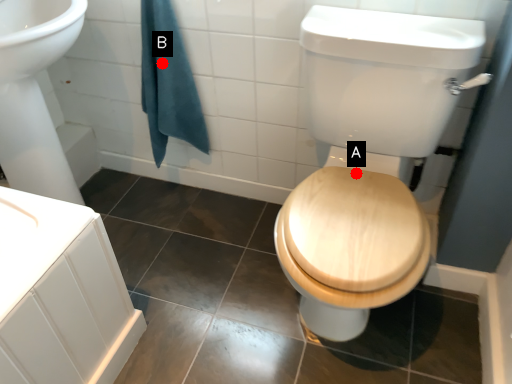
Question: Two points are circled on the image, labeled by A and B beside each circle. Among these points, which one is farthest from the camera?

Choices:
 (A) A is further
 (B) B is further

Answer: (B)